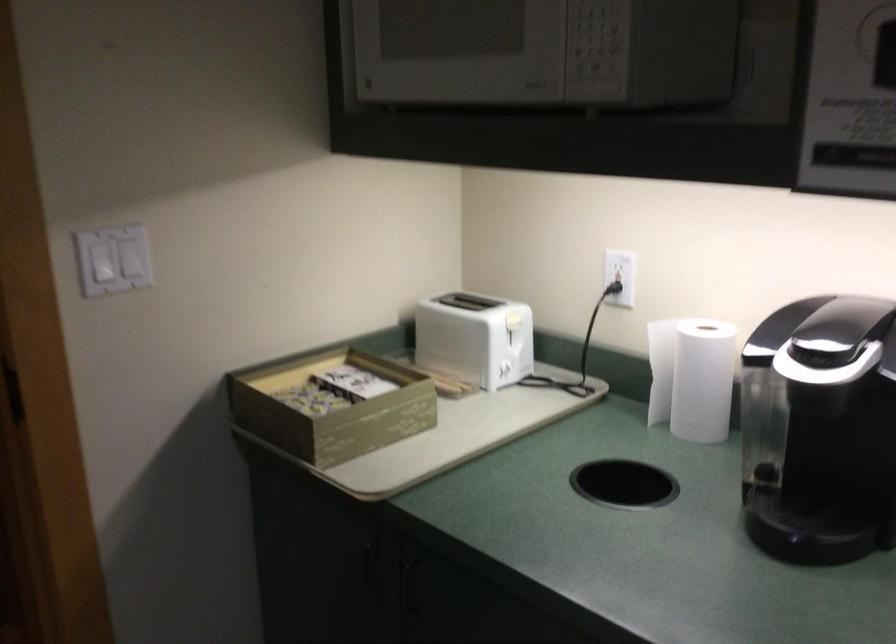
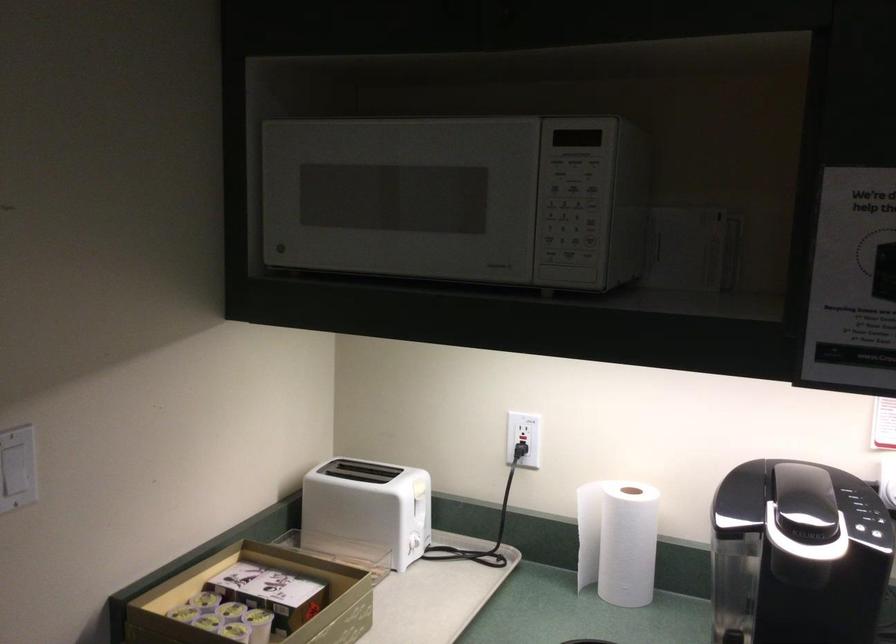
In the second image, find the point that corresponds to point (607, 290) in the first image.

(521, 456)